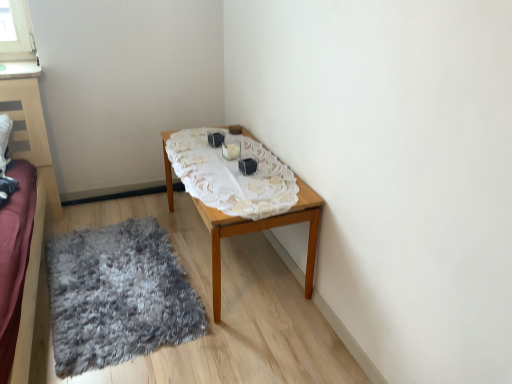
Question: Based on their positions, is white lace tablecloth at center located to the left or right of gray shaggy rug at lower left?

Choices:
 (A) left
 (B) right

Answer: (B)

Question: Based on their sizes in the image, would you say white lace tablecloth at center is bigger or smaller than gray shaggy rug at lower left?

Choices:
 (A) small
 (B) big

Answer: (A)

Question: Estimate the real-world distances between objects in this image. Which object is farther from the wooden table at center?

Choices:
 (A) gray shaggy rug at lower left
 (B) white lace tablecloth at center

Answer: (A)

Question: Considering the real-world distances, which object is closest to the wooden table at center?

Choices:
 (A) gray shaggy rug at lower left
 (B) white lace tablecloth at center

Answer: (B)